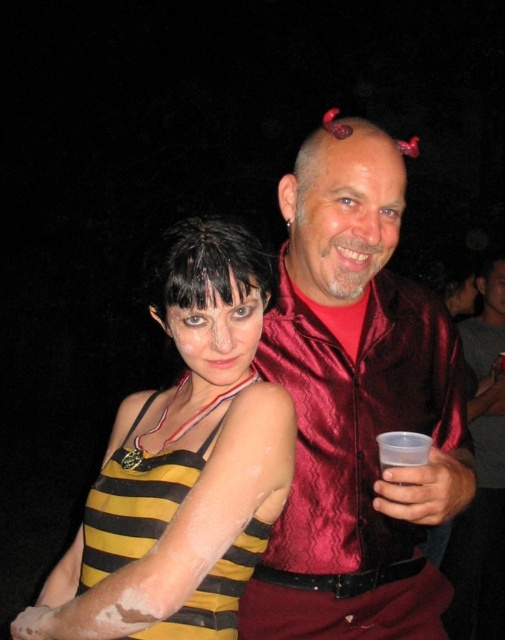
Does shiny red satin shirt at center have a greater width compared to yellow striped tank top at center?

In fact, shiny red satin shirt at center might be narrower than yellow striped tank top at center.

Can you confirm if shiny red satin shirt at center is taller than yellow striped tank top at center?

Yes, shiny red satin shirt at center is taller than yellow striped tank top at center.

Who is more distant from viewer, (388, 557) or (192, 509)?

Positioned behind is point (388, 557).

Where is `shiny red satin shirt at center`? This screenshot has width=505, height=640. shiny red satin shirt at center is located at coordinates coord(357,406).

Does shiny red shirt at center appear over dark shiny hair at center?

No.

Is shiny red shirt at center smaller than dark shiny hair at center?

No.

Image resolution: width=505 pixels, height=640 pixels. What do you see at coordinates (481, 476) in the screenshot? I see `shiny red shirt at center` at bounding box center [481, 476].

Locate an element on the screen. The width and height of the screenshot is (505, 640). shiny red shirt at center is located at coordinates (481, 476).

Who is more distant from viewer, (102, 568) or (198, 292)?

Point (102, 568)

Who is more distant from viewer, (87, 550) or (264, 289)?

The point (87, 550) is more distant.

The height and width of the screenshot is (640, 505). I want to click on white matte arm at center, so click(x=134, y=500).